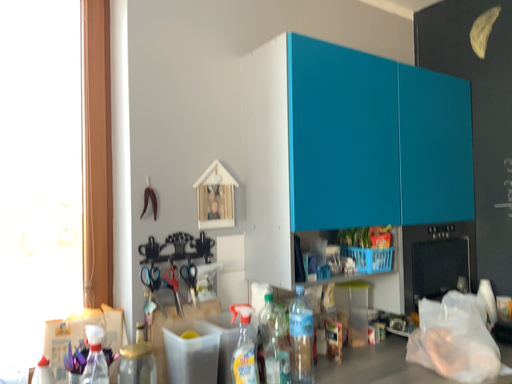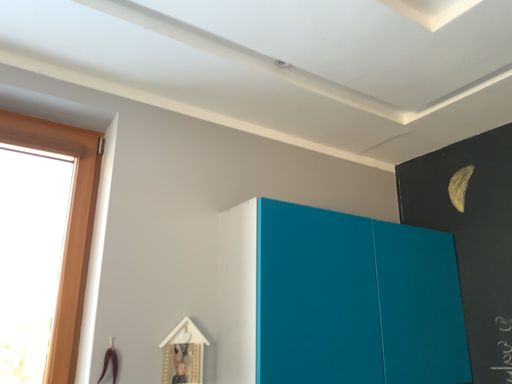
Question: How did the camera likely rotate when shooting the video?

Choices:
 (A) rotated downward
 (B) rotated upward

Answer: (B)